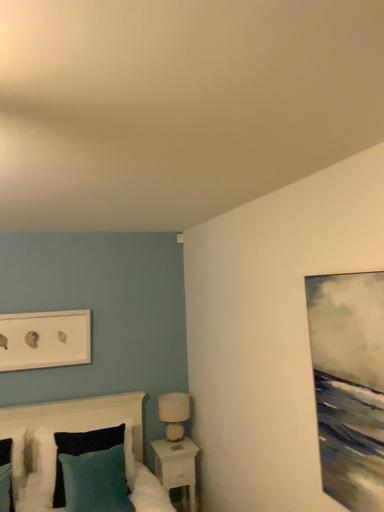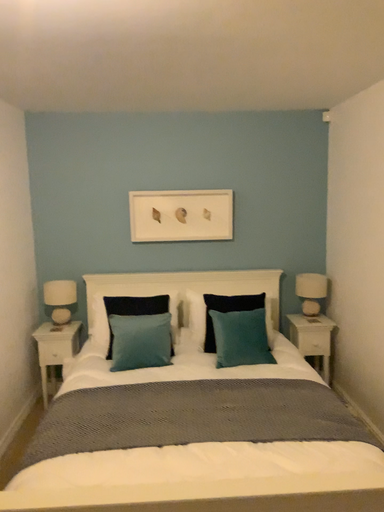
Question: Which way did the camera rotate in the video?

Choices:
 (A) rotated left
 (B) rotated right

Answer: (A)